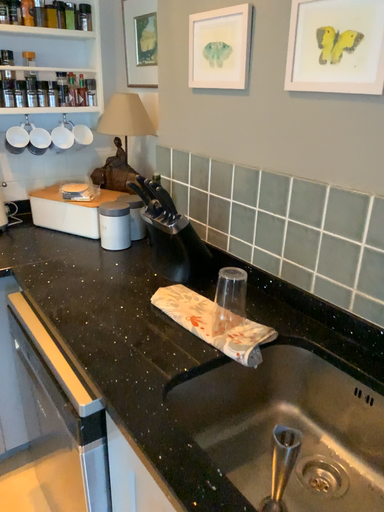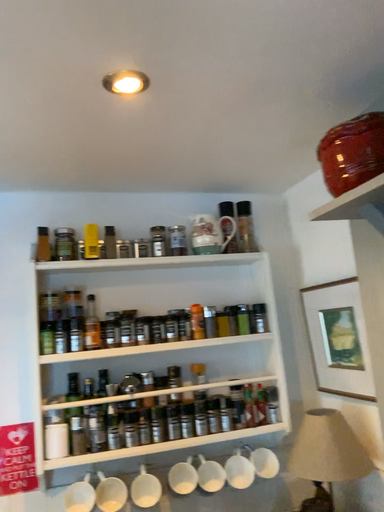
Question: How did the camera likely rotate when shooting the video?

Choices:
 (A) rotated left
 (B) rotated right

Answer: (A)